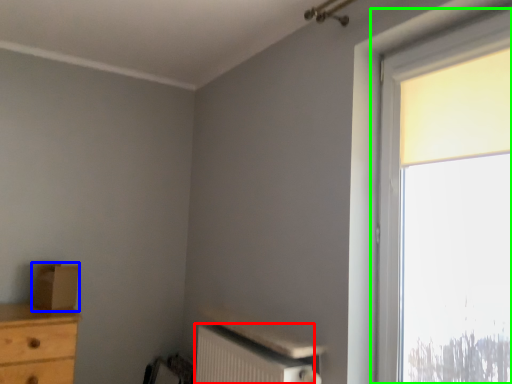
Question: Based on their relative distances, which object is nearer to radiator (highlighted by a red box)? Choose from cardboard box (highlighted by a blue box) and window (highlighted by a green box).

Choices:
 (A) cardboard box
 (B) window

Answer: (B)